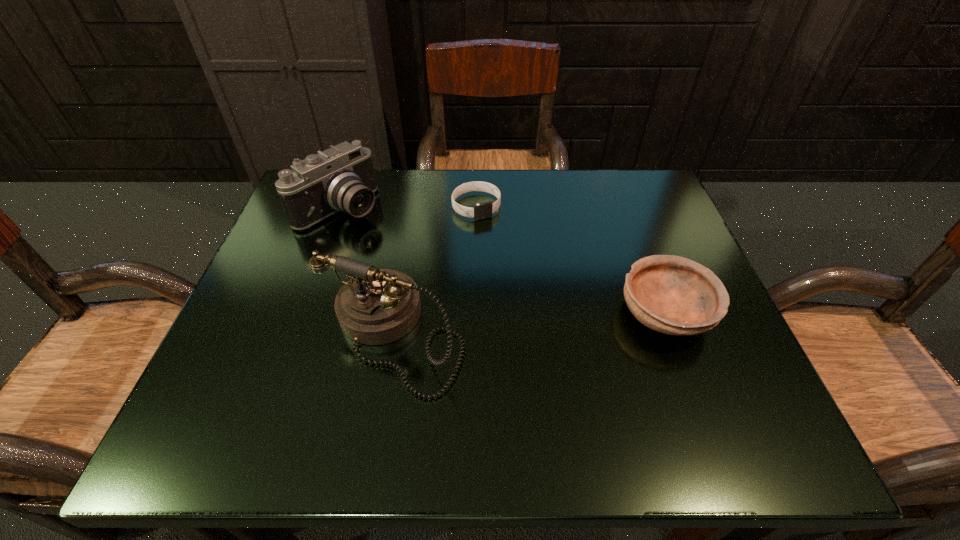
Where is `object located at the near left corner`? This screenshot has height=540, width=960. object located at the near left corner is located at coordinates (376, 306).

The image size is (960, 540). What are the coordinates of `vacant space at the far edge of the desktop` in the screenshot? It's located at (447, 207).

Identify the location of vacant space at the left edge of the desktop. Image resolution: width=960 pixels, height=540 pixels. (316, 296).

At what (x,y) coordinates should I click in order to perform the action: click on free space at the right edge of the desktop. Please return your answer as a coordinate pair (x, y). The image size is (960, 540). Looking at the image, I should click on (618, 265).

Image resolution: width=960 pixels, height=540 pixels. In the image, there is a desktop. Find the location of `free space at the far left corner`. free space at the far left corner is located at coordinates (327, 227).

This screenshot has height=540, width=960. Find the location of `free spot at the near left corner of the desktop`. free spot at the near left corner of the desktop is located at coordinates pyautogui.click(x=273, y=357).

Identify the location of free space at the far right corner of the desktop. [595, 178].

Where is `vacant area that lies between the third tallest object and the camera`? This screenshot has height=540, width=960. vacant area that lies between the third tallest object and the camera is located at coordinates point(503,260).

Locate an element on the screen. free space between the camera and the bowl is located at coordinates (503, 260).

Find the location of a particular element. This screenshot has width=960, height=540. free space between the third tallest object and the camera is located at coordinates (503, 260).